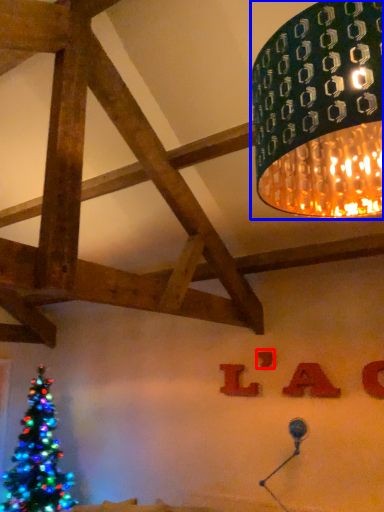
Question: Which object appears farthest to the camera in this image, letter (highlighted by a red box) or lamp (highlighted by a blue box)?

Choices:
 (A) letter
 (B) lamp

Answer: (A)